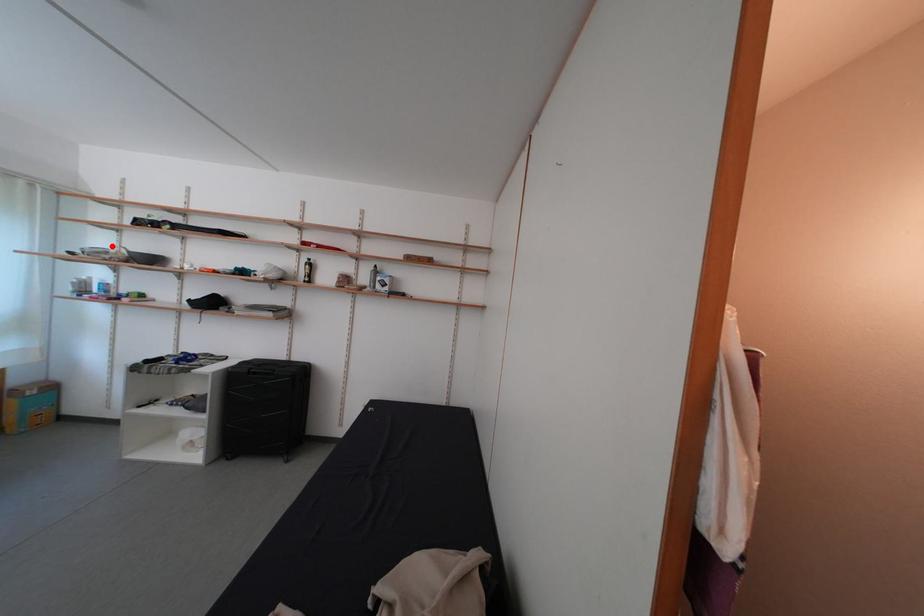
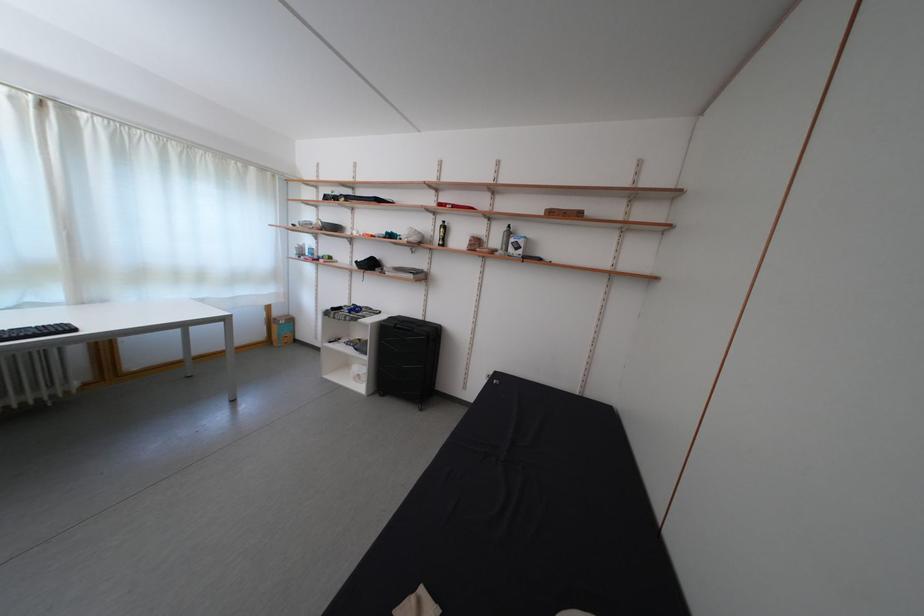
The point at the highlighted location is marked in the first image. Where is the corresponding point in the second image?

(319, 221)